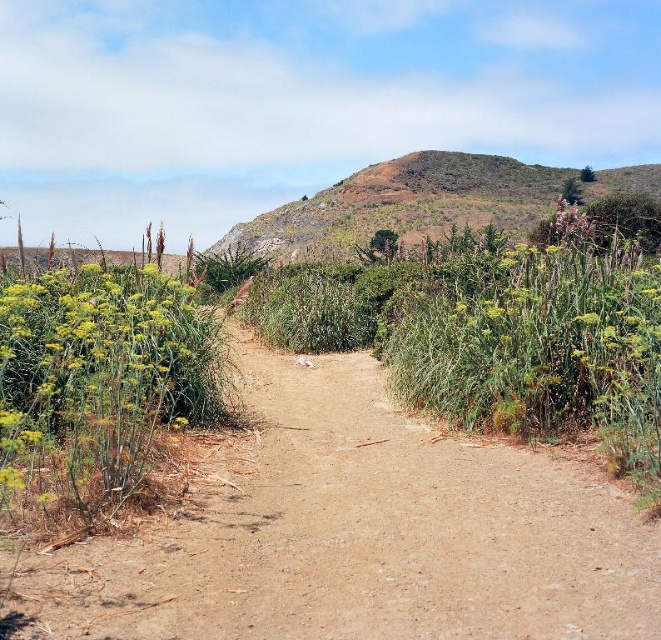
Is green leafy plant at left smaller than green grassy hillside at upper center?

Yes.

Is green leafy plant at left positioned in front of green grassy hillside at upper center?

Yes, green leafy plant at left is in front of green grassy hillside at upper center.

Is point (97, 330) closer to camera compared to point (418, 230)?

That is True.

The image size is (661, 640). Find the location of `green leafy plant at left`. green leafy plant at left is located at coordinates (89, 372).

Consider the image. Does brown dirt track at center have a lesser height compared to green leafy plant at left?

Yes, brown dirt track at center is shorter than green leafy plant at left.

Who is taller, brown dirt track at center or green leafy plant at left?

With more height is green leafy plant at left.

Is point (286, 496) more distant than point (169, 406)?

No, (286, 496) is closer to viewer.

Identify the location of brown dirt track at center. (360, 532).

Does brown dirt track at center appear on the right side of green grassy hillside at upper center?

In fact, brown dirt track at center is to the left of green grassy hillside at upper center.

Between brown dirt track at center and green grassy hillside at upper center, which one is positioned lower?

brown dirt track at center is lower down.

Between point (258, 568) and point (373, 220), which one is positioned in front?

Point (258, 568)

You are a GUI agent. You are given a task and a screenshot of the screen. Output one action in this format:
    pyautogui.click(x=<x>, y=<y>)
    Task: Click on the brown dirt track at center
    
    Given the screenshot: What is the action you would take?
    pyautogui.click(x=360, y=532)